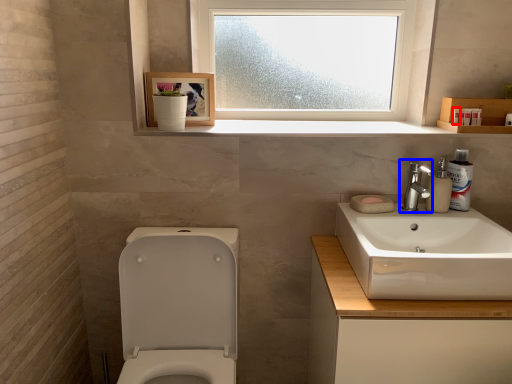
Question: Which of the following is the closest to the observer, toiletry (highlighted by a red box) or tap (highlighted by a blue box)?

Choices:
 (A) toiletry
 (B) tap

Answer: (B)